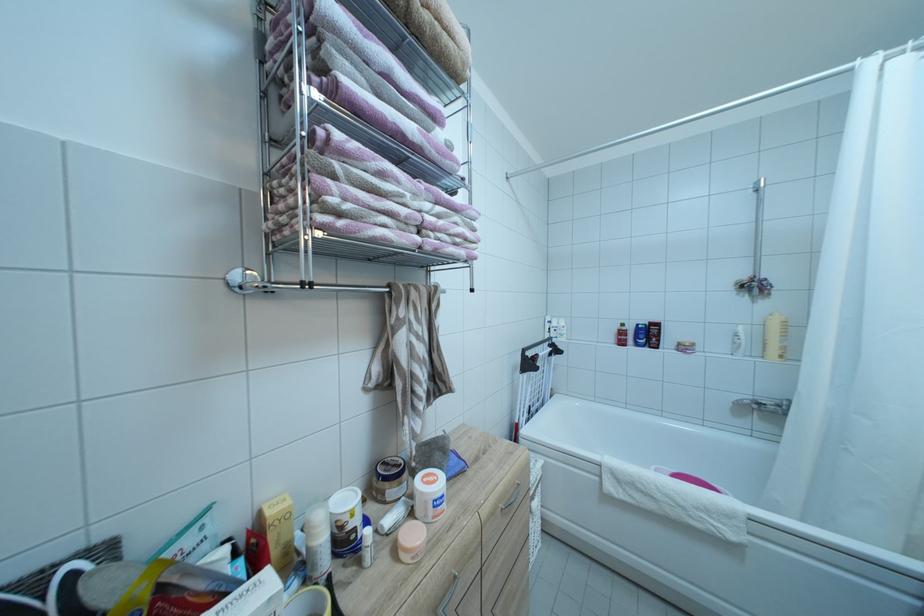
Describe the element at coordinates (429, 495) in the screenshot. I see `the white pump bottle top` at that location.